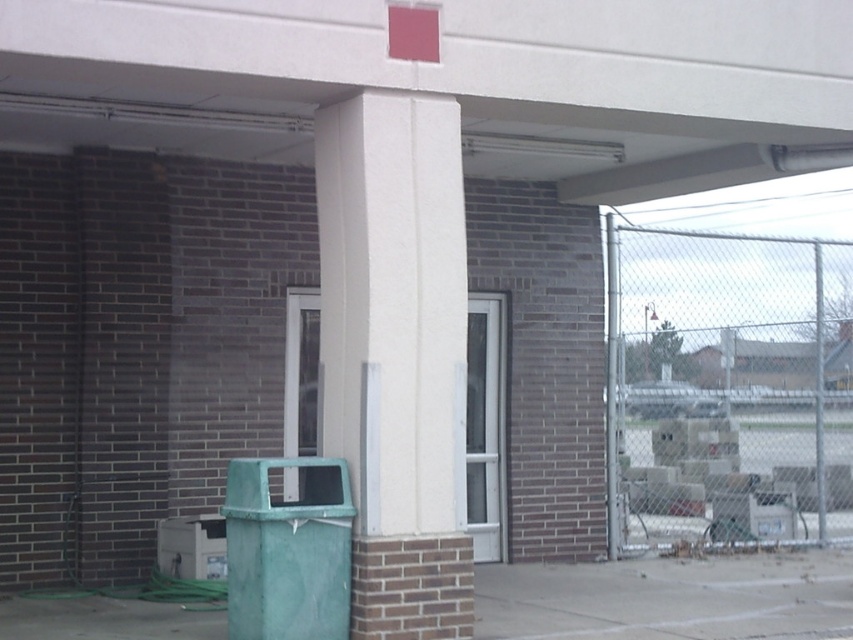
Question: Is metal chain-link fence at right bigger than white smooth pillar at center?

Choices:
 (A) yes
 (B) no

Answer: (A)

Question: Does metal chain-link fence at right appear over white smooth pillar at center?

Choices:
 (A) yes
 (B) no

Answer: (B)

Question: Among these points, which one is farthest from the camera?

Choices:
 (A) (361, 582)
 (B) (780, 291)

Answer: (B)

Question: Does metal chain-link fence at right appear over white smooth pillar at center?

Choices:
 (A) yes
 (B) no

Answer: (B)